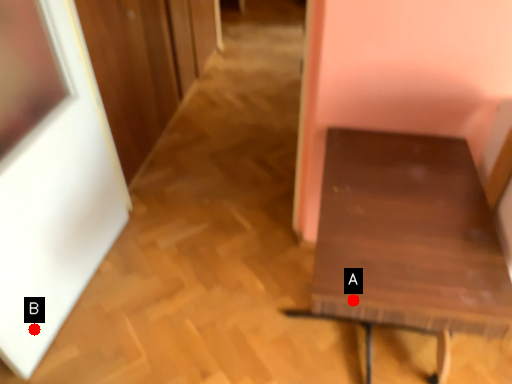
Question: Two points are circled on the image, labeled by A and B beside each circle. Among these points, which one is farthest from the camera?

Choices:
 (A) A is further
 (B) B is further

Answer: (B)